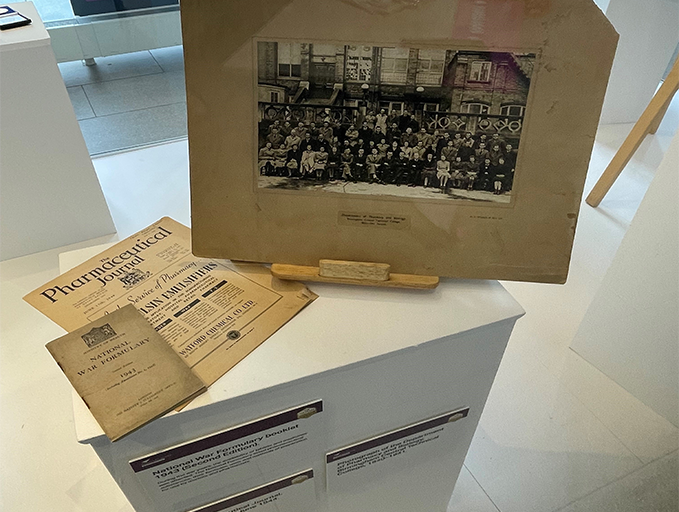
The height and width of the screenshot is (512, 679). Find the location of `surface top`. surface top is located at coordinates (288, 369).